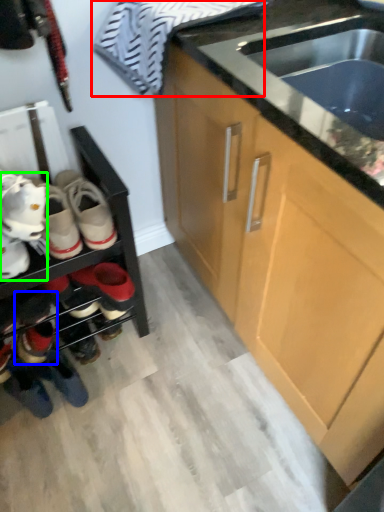
Question: Which is farther away from laundry (highlighted by a red box)? footwear (highlighted by a blue box) or footwear (highlighted by a green box)?

Choices:
 (A) footwear
 (B) footwear

Answer: (A)